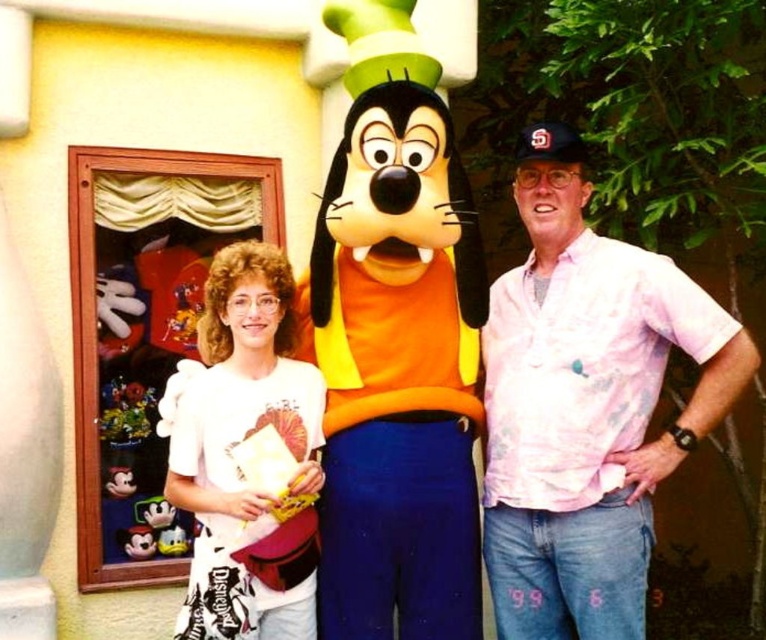
Consider the image. Does pink floral shirt at right have a larger size compared to white cotton shirt at left?

Yes, pink floral shirt at right is bigger than white cotton shirt at left.

Does pink floral shirt at right have a lesser height compared to white cotton shirt at left?

In fact, pink floral shirt at right may be taller than white cotton shirt at left.

Locate an element on the screen. This screenshot has height=640, width=766. pink floral shirt at right is located at coordinates (586, 404).